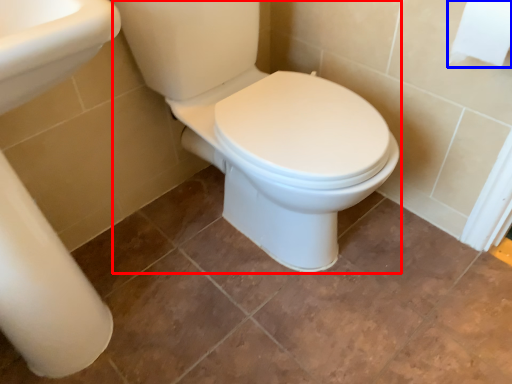
Question: Which of the following is the farthest to the observer, porcelain (highlighted by a red box) or toilet paper (highlighted by a blue box)?

Choices:
 (A) porcelain
 (B) toilet paper

Answer: (B)